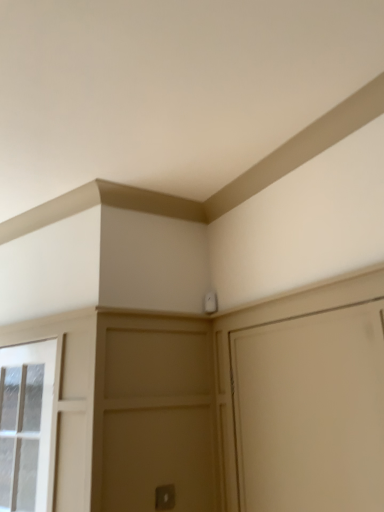
Question: In terms of width, does clear glass window at left look wider or thinner when compared to silver metallic door handle at lower center?

Choices:
 (A) thin
 (B) wide

Answer: (B)

Question: Relative to silver metallic door handle at lower center, is clear glass window at left in front or behind?

Choices:
 (A) behind
 (B) front

Answer: (B)

Question: Based on their positions, is clear glass window at left located to the left or right of silver metallic door handle at lower center?

Choices:
 (A) left
 (B) right

Answer: (A)

Question: In the image, is silver metallic door handle at lower center positioned in front of or behind clear glass window at left?

Choices:
 (A) front
 (B) behind

Answer: (B)

Question: Based on their sizes in the image, would you say silver metallic door handle at lower center is bigger or smaller than clear glass window at left?

Choices:
 (A) big
 (B) small

Answer: (B)

Question: Is silver metallic door handle at lower center situated inside clear glass window at left or outside?

Choices:
 (A) outside
 (B) inside

Answer: (A)

Question: Looking at their shapes, would you say silver metallic door handle at lower center is wider or thinner than clear glass window at left?

Choices:
 (A) thin
 (B) wide

Answer: (A)